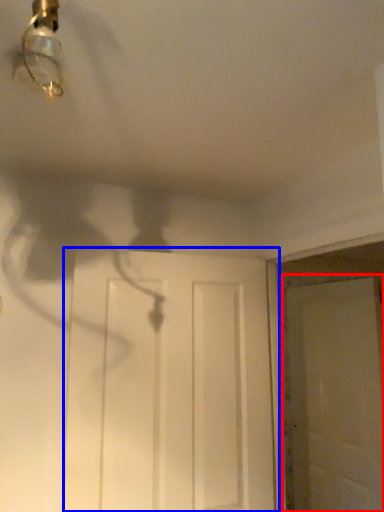
Question: Among these objects, which one is nearest to the camera, door (highlighted by a red box) or door (highlighted by a blue box)?

Choices:
 (A) door
 (B) door

Answer: (B)